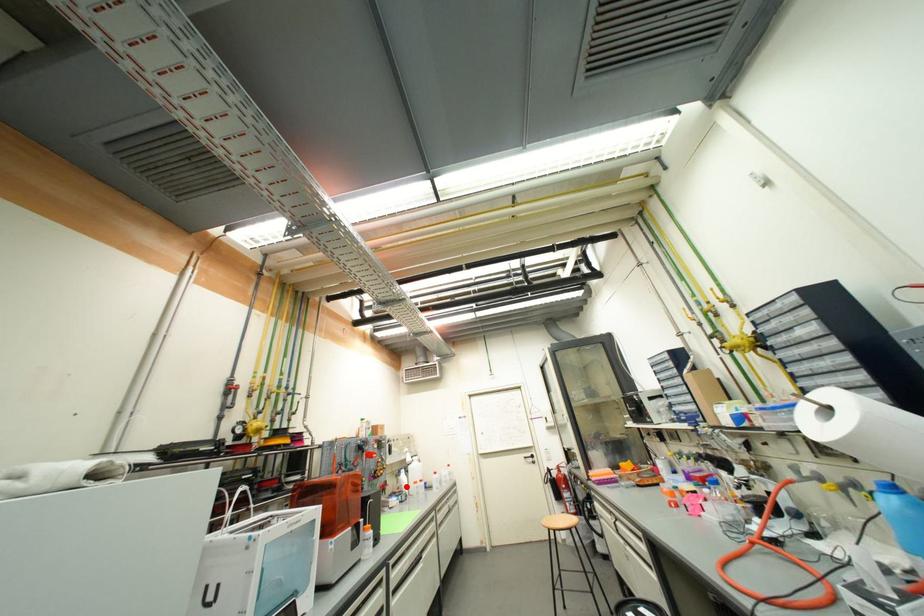
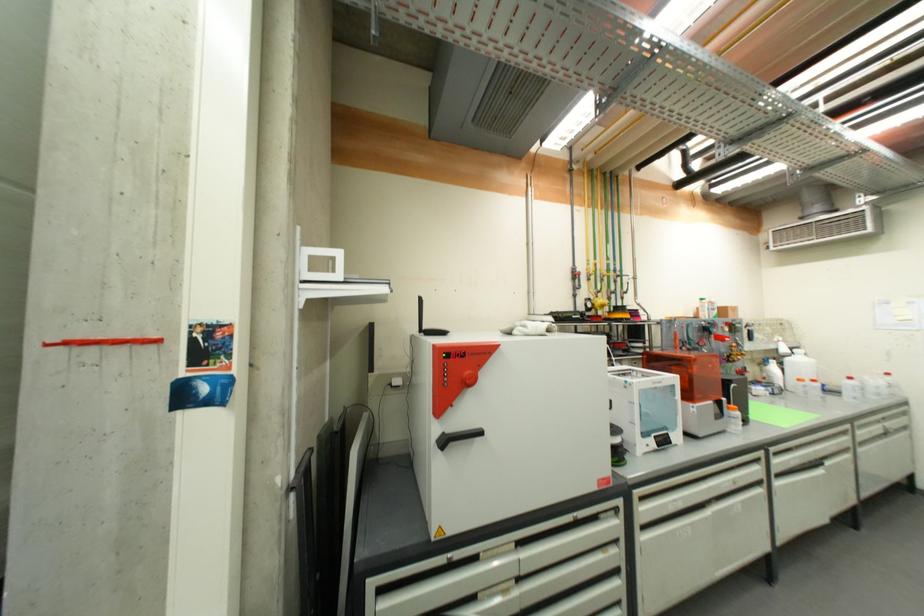
Where in the second image is the point corresponding to the highlighted location from the first image?

(774, 378)